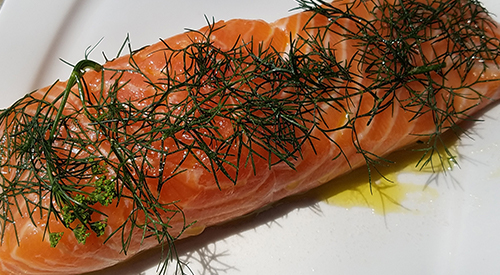
Where is `plate`? plate is located at coordinates (285, 254).